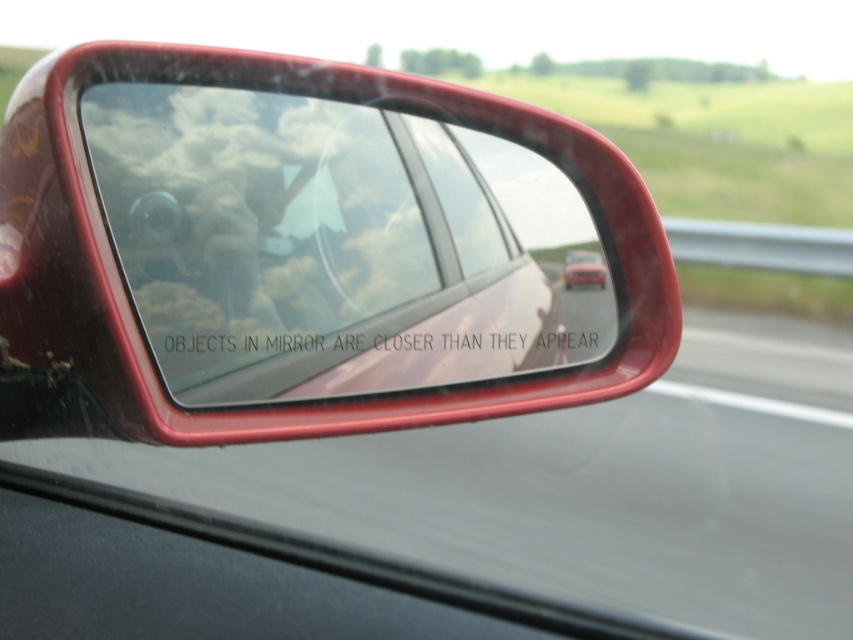
Question: Among these objects, which one is farthest from the camera?

Choices:
 (A) matte red car at center
 (B) transparent glass windshield at center

Answer: (A)

Question: Is transparent glass windshield at center in front of matte red car at center?

Choices:
 (A) yes
 (B) no

Answer: (A)

Question: Considering the relative positions of transparent glass windshield at center and matte red car at center in the image provided, where is transparent glass windshield at center located with respect to matte red car at center?

Choices:
 (A) right
 (B) left

Answer: (B)

Question: Among these points, which one is farthest from the camera?

Choices:
 (A) (605, 272)
 (B) (287, 108)

Answer: (A)

Question: Is transparent glass windshield at center below matte red car at center?

Choices:
 (A) yes
 (B) no

Answer: (B)